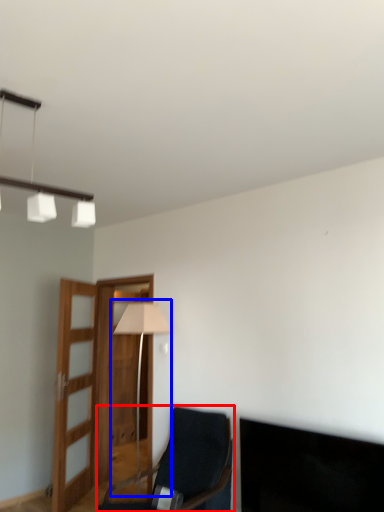
Question: Which object appears closest to the camera in this image, chair (highlighted by a red box) or table lamp (highlighted by a blue box)?

Choices:
 (A) chair
 (B) table lamp

Answer: (A)